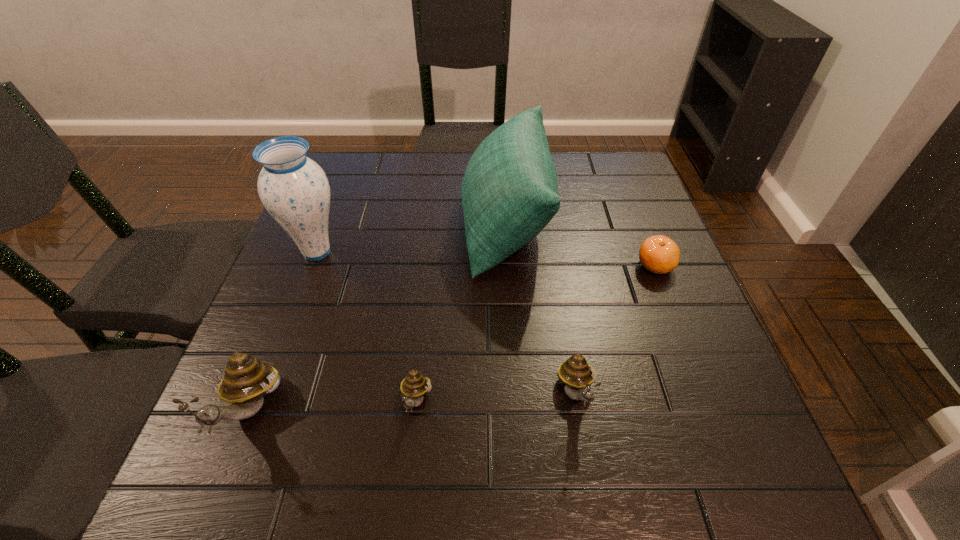
Find the location of a particular element. The width and height of the screenshot is (960, 540). free space at the far edge of the desktop is located at coordinates (436, 169).

This screenshot has height=540, width=960. I want to click on free space at the near edge, so click(325, 394).

Find the location of `free space at the left edge of the desktop`. free space at the left edge of the desktop is located at coordinates (322, 275).

Image resolution: width=960 pixels, height=540 pixels. I want to click on vacant space at the right edge of the desktop, so click(x=684, y=332).

This screenshot has height=540, width=960. What are the coordinates of `blank area at the near left corner` in the screenshot? It's located at (282, 428).

At what (x,y) coordinates should I click in order to perform the action: click on vacant region between the second snail from left to right and the leftmost snail. Please return your answer as a coordinate pair (x, y). This screenshot has height=540, width=960. Looking at the image, I should click on (334, 406).

This screenshot has width=960, height=540. I want to click on free point between the tallest object and the second tallest snail, so click(446, 322).

Identify the location of free space between the vase and the tallest snail. (284, 330).

This screenshot has width=960, height=540. Identify the location of empty space between the second snail from left to right and the second tallest object. (461, 313).

This screenshot has height=540, width=960. I want to click on free space between the fifth tallest object and the fourth tallest object, so click(496, 397).